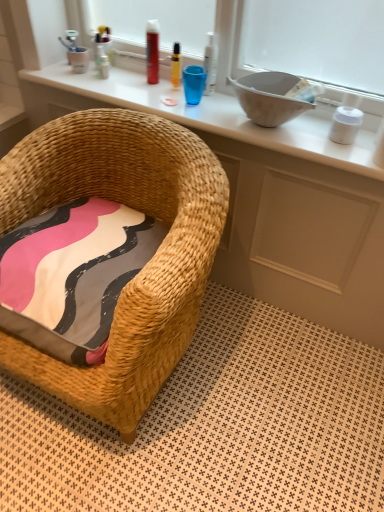
What are the coordinates of `spots to the right of shiny red can at upper center, positioned as the fourth toiletry in right-to-left order` in the screenshot? It's located at (182, 89).